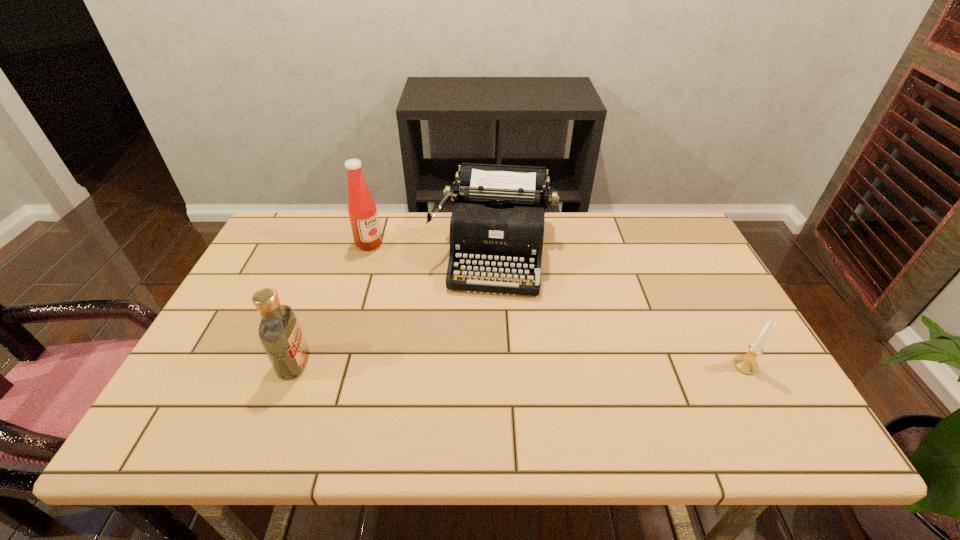
The width and height of the screenshot is (960, 540). I want to click on vacant area that lies between the candle holder and the leftmost object, so click(519, 364).

You are a GUI agent. You are given a task and a screenshot of the screen. Output one action in this format:
    pyautogui.click(x=<x>, y=<y>)
    Task: Click on the free space between the typewriter and the leftmost object
    
    Given the screenshot: What is the action you would take?
    tap(394, 307)

The width and height of the screenshot is (960, 540). What are the coordinates of `vacant point located between the tallest object and the typewriter` in the screenshot? It's located at (431, 248).

At what (x,y) coordinates should I click in order to perform the action: click on unoccupied position between the condiment and the vodka. Please return your answer as a coordinate pair (x, y). Looking at the image, I should click on (331, 303).

I want to click on vacant space that's between the third object from right to left and the vodka, so pyautogui.click(x=331, y=303).

Locate an element on the screen. The width and height of the screenshot is (960, 540). free space between the second object from right to left and the leftmost object is located at coordinates (394, 307).

Find the location of a particular element. This screenshot has width=960, height=540. unoccupied position between the rightmost object and the tallest object is located at coordinates (557, 305).

You are a GUI agent. You are given a task and a screenshot of the screen. Output one action in this format:
    pyautogui.click(x=<x>, y=<y>)
    Task: Click on the object that stands as the second closest to the second object from right to left
    The height and width of the screenshot is (540, 960).
    Given the screenshot: What is the action you would take?
    pyautogui.click(x=279, y=332)

Where is `object that is the second closest to the condiment`? The width and height of the screenshot is (960, 540). object that is the second closest to the condiment is located at coordinates (279, 332).

The height and width of the screenshot is (540, 960). I want to click on free spot that satisfies the following two spatial constraints: 1. on the front side of the second object from left to right; 2. on the left side of the third object from left to right, so click(367, 252).